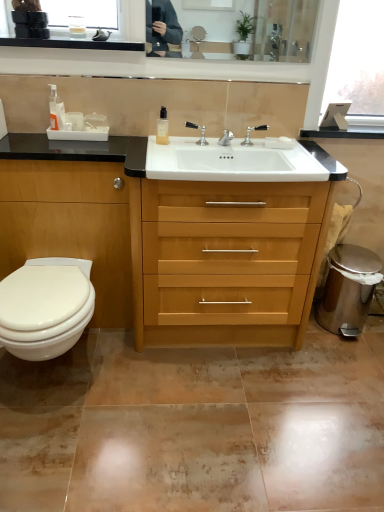
At what (x,y) coordinates should I click in order to perform the action: click on vacant region in front of polished silver faucet at center. Please return your answer as a coordinate pair (x, y). This screenshot has width=384, height=512. Looking at the image, I should click on (195, 154).